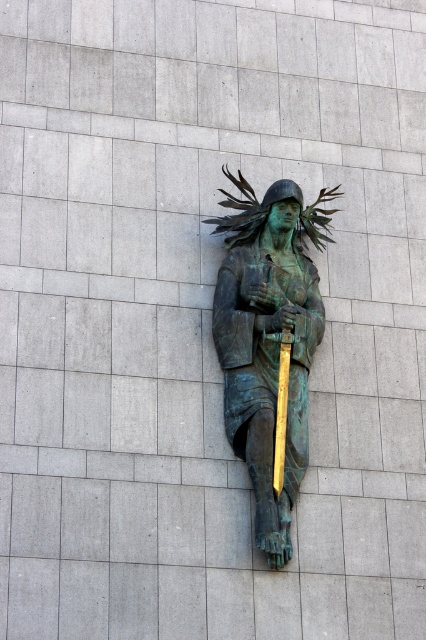
Question: Which object appears closest to the camera in this image?

Choices:
 (A) gold polished spear at center
 (B) green patina bronze statue at center

Answer: (B)

Question: Does green patina bronze statue at center have a greater width compared to gold polished spear at center?

Choices:
 (A) no
 (B) yes

Answer: (B)

Question: Observing the image, what is the correct spatial positioning of green patina bronze statue at center in reference to gold polished spear at center?

Choices:
 (A) above
 (B) below

Answer: (A)

Question: Does green patina bronze statue at center appear over gold polished spear at center?

Choices:
 (A) yes
 (B) no

Answer: (A)